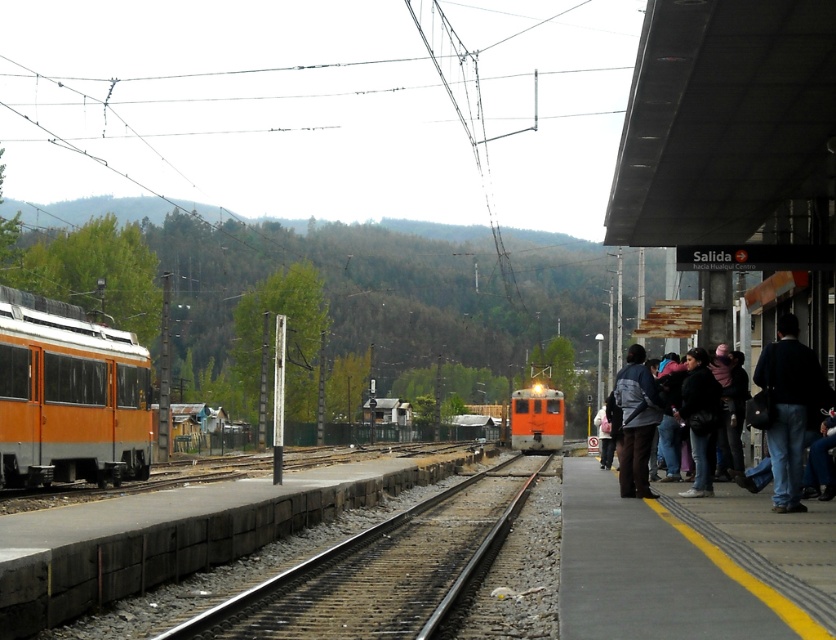
Question: Can you confirm if dark blue jeans at right is positioned to the left of orange matte train at center?

Choices:
 (A) yes
 (B) no

Answer: (A)

Question: Is gray concrete platform at right to the left of dark gray jacket at center from the viewer's perspective?

Choices:
 (A) no
 (B) yes

Answer: (A)

Question: Is orange matte train at left to the left of dark gray jacket at center from the viewer's perspective?

Choices:
 (A) yes
 (B) no

Answer: (A)

Question: Among these objects, which one is nearest to the camera?

Choices:
 (A) orange matte train at left
 (B) dark gray jacket at center
 (C) orange matte train at center
 (D) dark blue jeans at right

Answer: (D)

Question: Which point is farther to the camera?

Choices:
 (A) (539, 417)
 (B) (630, 477)
 (C) (223, 609)
 (D) (794, 355)

Answer: (A)

Question: Which of these objects is positioned farthest from the dark gray jacket at center?

Choices:
 (A) dark gray fabric jacket at right
 (B) smooth concrete train track at center

Answer: (B)